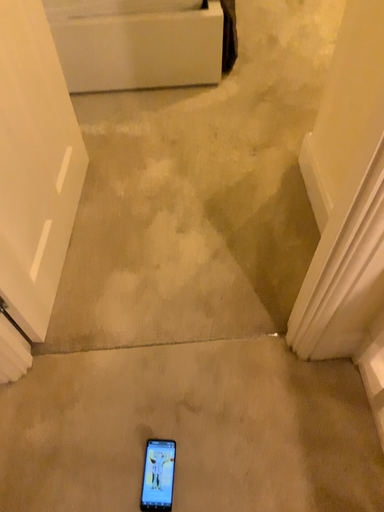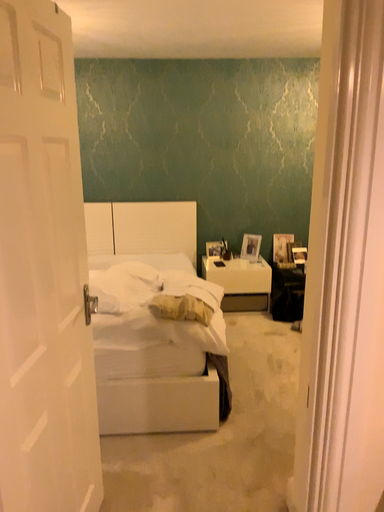
Question: Which way did the camera rotate in the video?

Choices:
 (A) rotated upward
 (B) rotated downward

Answer: (A)